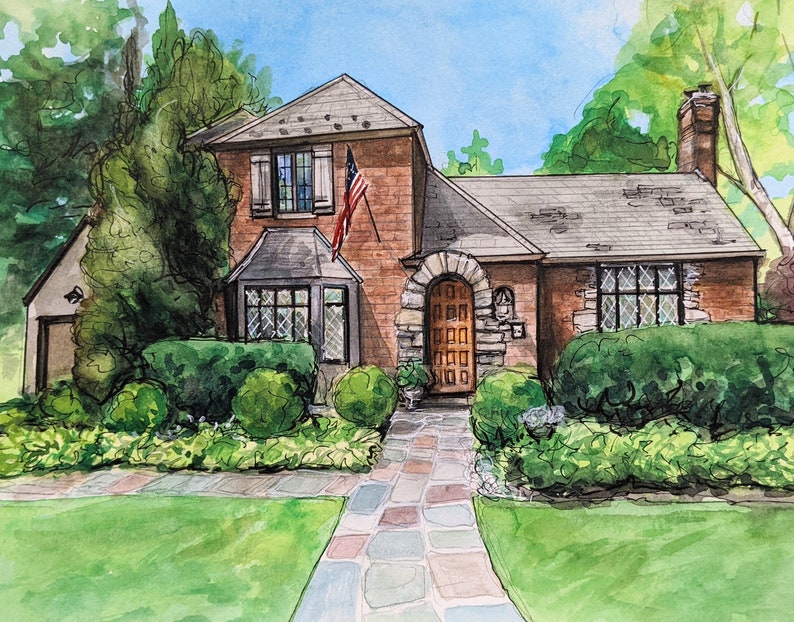
Where is `front door`? This screenshot has height=622, width=794. front door is located at coordinates (457, 351).